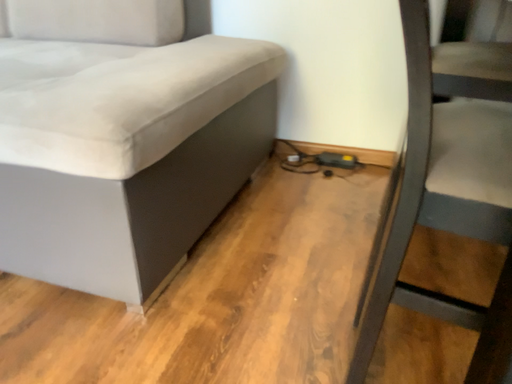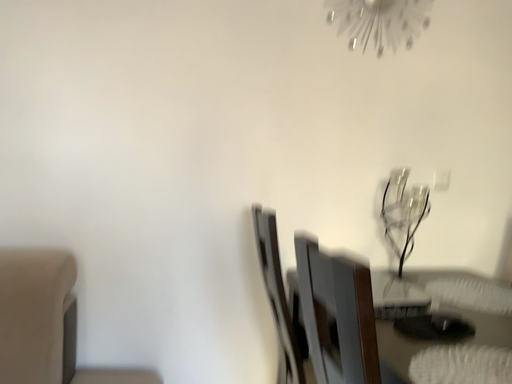
Question: How did the camera likely rotate when shooting the video?

Choices:
 (A) rotated upward
 (B) rotated downward

Answer: (A)